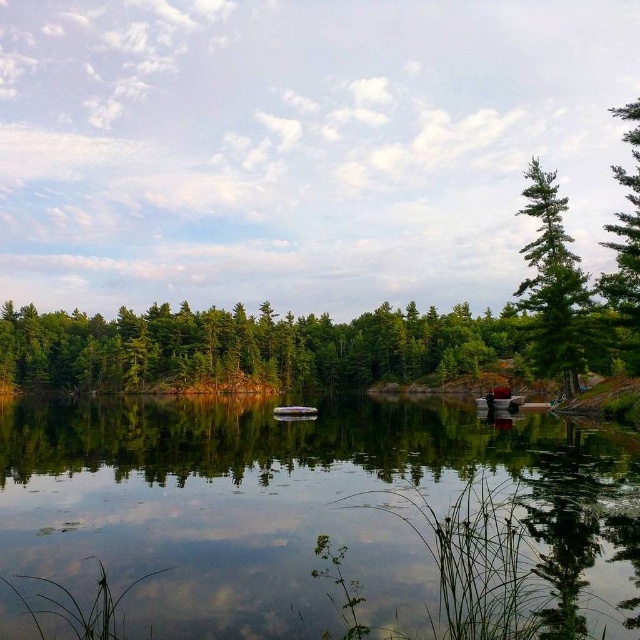
Between green textured trees at left and green textured pine tree at upper right, which one appears on the right side from the viewer's perspective?

Positioned to the right is green textured pine tree at upper right.

Can you confirm if green textured trees at left is positioned to the right of green textured pine tree at upper right?

No, green textured trees at left is not to the right of green textured pine tree at upper right.

Which is behind, point (156, 320) or point (630, 109)?

The point (156, 320) is more distant.

Find the location of `green textured trees at left`. green textured trees at left is located at coordinates (246, 346).

Which is above, green textured tree at right or metallic red boat at lower right?

green textured tree at right

At what (x,y) coordinates should I click in order to perform the action: click on green textured tree at right. Please return your answer as a coordinate pair (x, y). Looking at the image, I should click on (554, 285).

The width and height of the screenshot is (640, 640). Identify the location of green textured tree at right. (554, 285).

This screenshot has height=640, width=640. Identify the location of green textured tree at right. (554, 285).

Can you confirm if green textured tree at right is positioned above green textured pine tree at upper right?

Actually, green textured tree at right is below green textured pine tree at upper right.

What do you see at coordinates (554, 285) in the screenshot?
I see `green textured tree at right` at bounding box center [554, 285].

You are a GUI agent. You are given a task and a screenshot of the screen. Output one action in this format:
    pyautogui.click(x=<x>, y=<y>)
    Task: Click on the green textured tree at right
    The height and width of the screenshot is (640, 640).
    Given the screenshot: What is the action you would take?
    pyautogui.click(x=554, y=285)